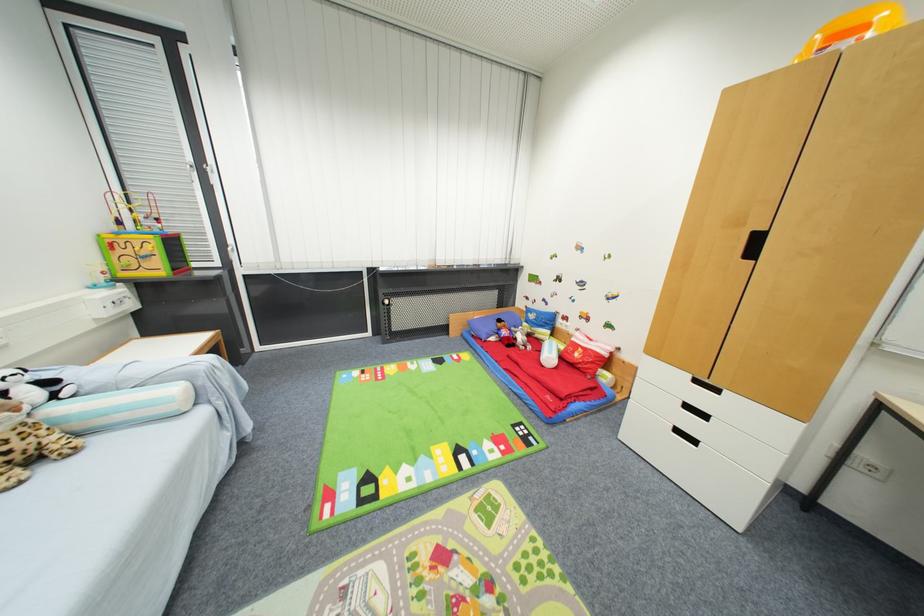
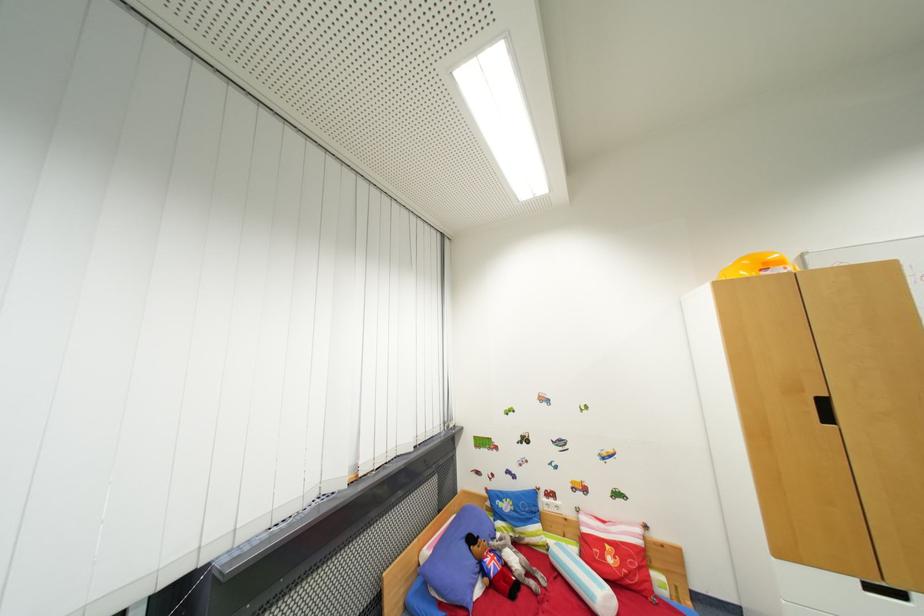
Locate, in the second image, the point that corresponds to (505,323) in the first image.

(477, 541)